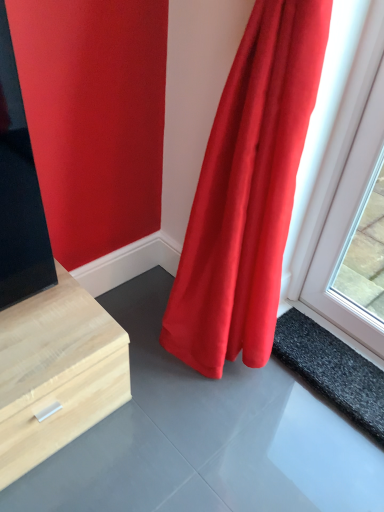
Where is `space that is in front of matte red curtain at right`? Image resolution: width=384 pixels, height=512 pixels. space that is in front of matte red curtain at right is located at coordinates [x=232, y=460].